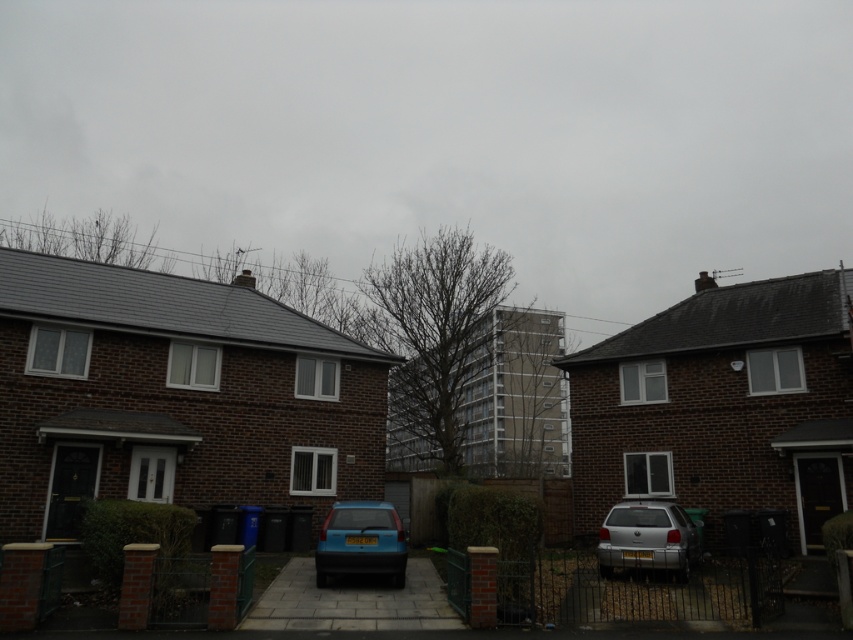
You are a delivery driver who needs to park your vehicle in this residential area. You see the silver metallic suv at lower right and the matte blue hatchback at center. Which vehicle is positioned closer to the right side of the image?

The silver metallic suv at lower right is to the right of the matte blue hatchback at center, so it is positioned closer to the right side of the image.

You are standing at the point marked by coordinates point (647, 538). Looking around, you see two terraced houses and a tree. Which direction should you walk to reach the driveway of the house on the left?

The silver metallic suv at lower right is represented by point (647, 538). Since you are at this point, you should walk towards the house on the left, which is to your left or north direction, depending on the layout. However, without additional spatial details, the exact direction cannot be determined precisely. However, based on typical terraced house layouts, moving towards the left house would involve walking north or west.

Based on the photo, you are a delivery person trying to park your van between the two houses. The van is 2 meters tall. There is a tree between the houses and a tall building behind it. Can you drive your van through the space between the silver metallic suv at lower right and the matte blue hatchback at center without hitting the tree or the building?

The silver metallic suv at lower right is below matte blue hatchback at center, so the space between them is vertical. Since the van is 2 meters tall, it can pass through the space between the silver metallic suv at lower right and the matte blue hatchback at center as long as the vertical clearance is sufficient. However, the question mentions avoiding the tree and building, but the description does not provide information about their heights or positions relative to the van. Therefore, proceed with care,